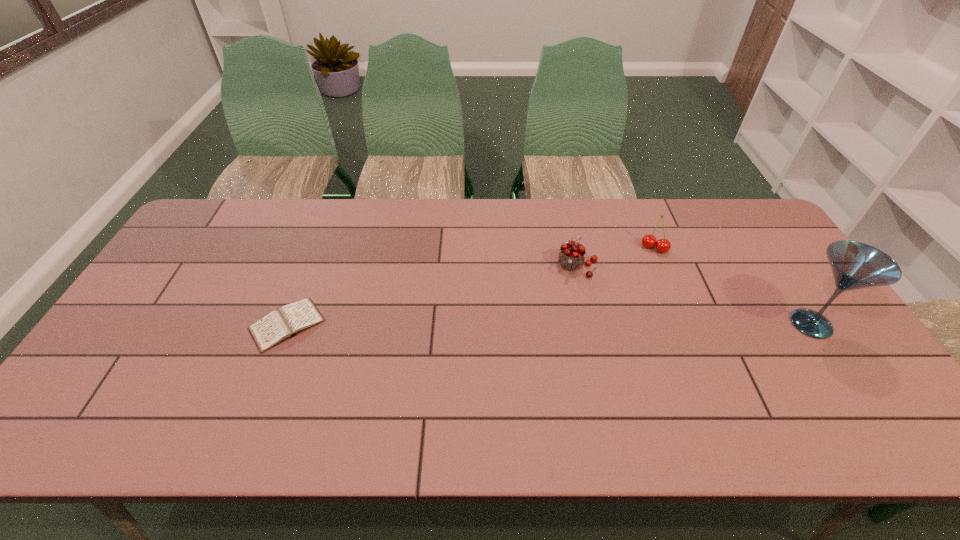
Identify the location of the second closest object to the right pot filled with cherries. (855, 265).

Locate an element on the screen. The width and height of the screenshot is (960, 540). the second closest object relative to the tallest object is located at coordinates (571, 256).

I want to click on free location that satisfies the following two spatial constraints: 1. on the back side of the diary; 2. on the left side of the right pot filled with cherries, so click(316, 248).

Identify the location of vacant point that satisfies the following two spatial constraints: 1. on the back side of the left pot filled with cherries; 2. on the left side of the shortest object. (309, 266).